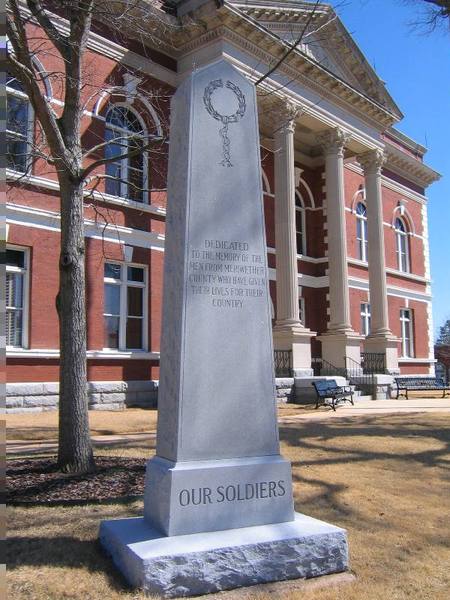
The width and height of the screenshot is (450, 600). What are the coordinates of `pillar` in the screenshot? It's located at (286, 243), (345, 242), (377, 249).